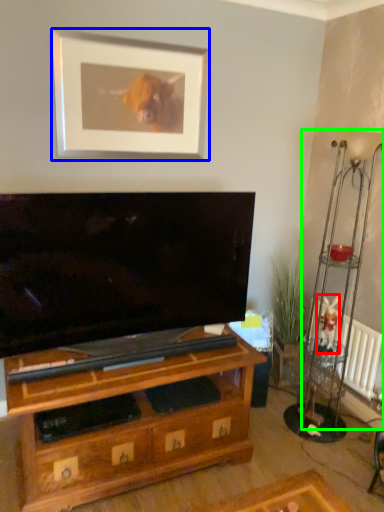
Question: Which is farther away from animal (highlighted by a red box)? picture frame (highlighted by a blue box) or lamp (highlighted by a green box)?

Choices:
 (A) picture frame
 (B) lamp

Answer: (A)